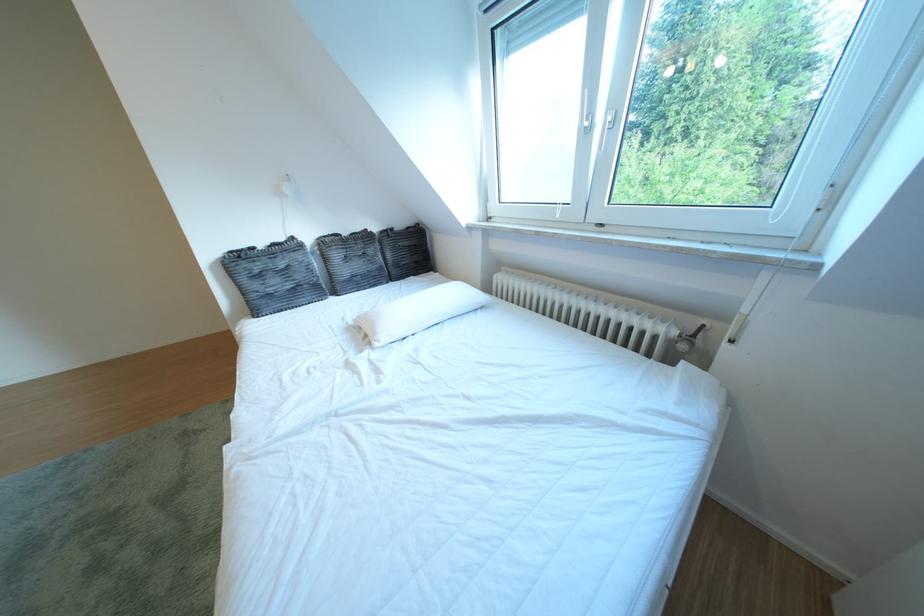
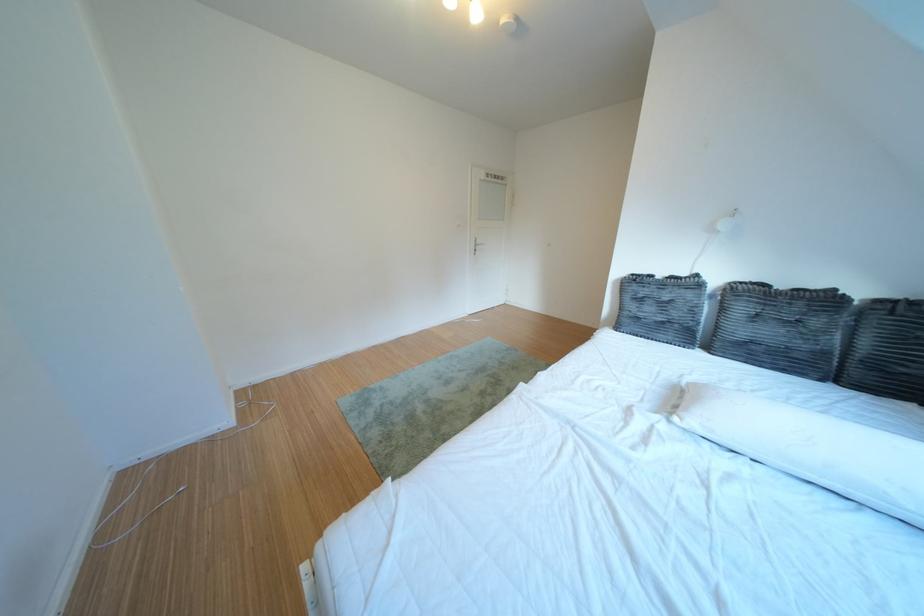
The point at (268, 301) is marked in the first image. Where is the corresponding point in the second image?

(639, 318)